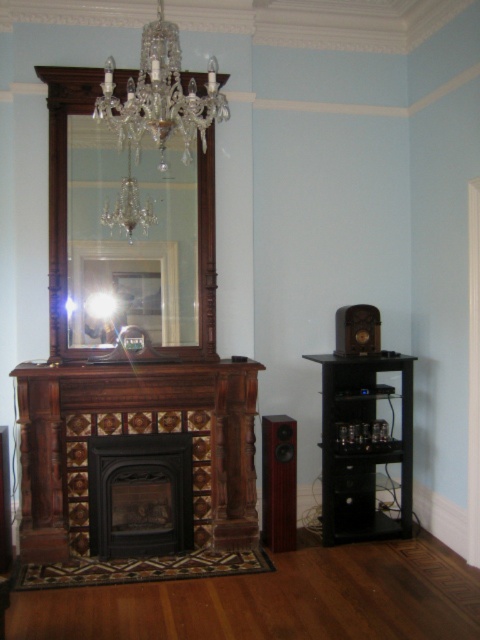
You are standing in the room and want to take a photo of both the crystal glass mirror at upper center and the clear crystal chandelier at upper center. Which object should you position to your left to include both in the frame?

The crystal glass mirror at upper center is to the right of the clear crystal chandelier at upper center, so you should position the clear crystal chandelier at upper center to your left to include both in the frame.

Looking at this image, you are standing in the room and see two points marked on the floor. The first point is at coordinate point (x=214, y=81) and the second is at point (x=283, y=433). Which point is closer to you?

Point (x=214, y=81) is in front of point (x=283, y=433), so it is closer to you.

You are an interior designer planning to replace the crystal glass chandelier at upper center and the mahogany wood speaker at right with new fixtures. If you want to ensure the new chandelier is wider than the speaker, does the current setup already meet this requirement?

Yes, the crystal glass chandelier at upper center is already wider than the mahogany wood speaker at right, so the current setup meets the requirement.